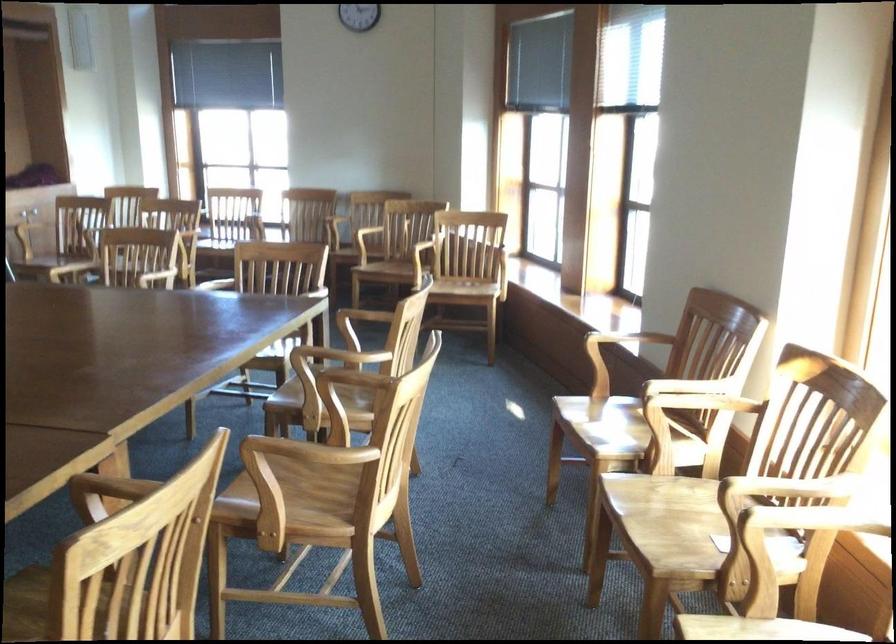
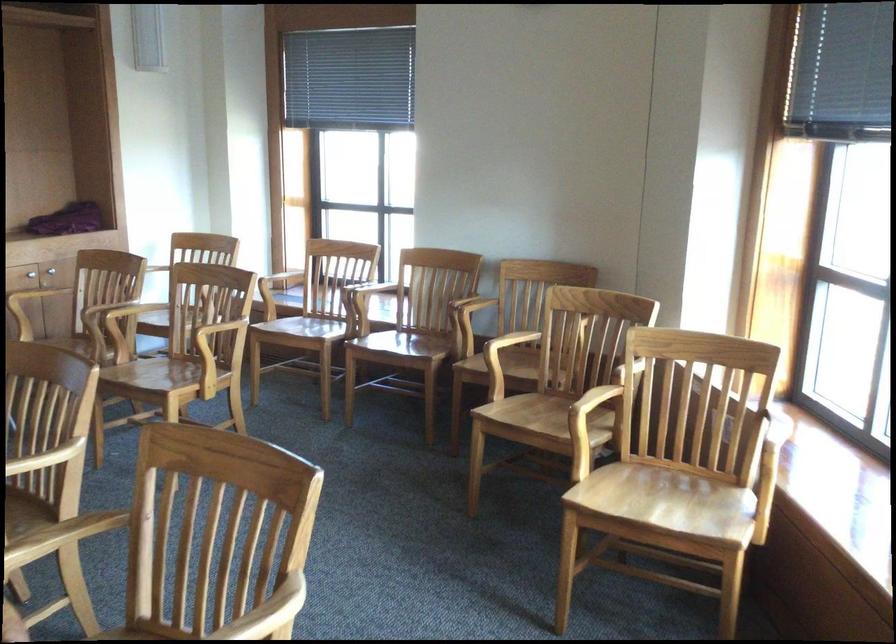
In the second image, find the point that corresponds to point 385,263 in the first image.

(547, 418)